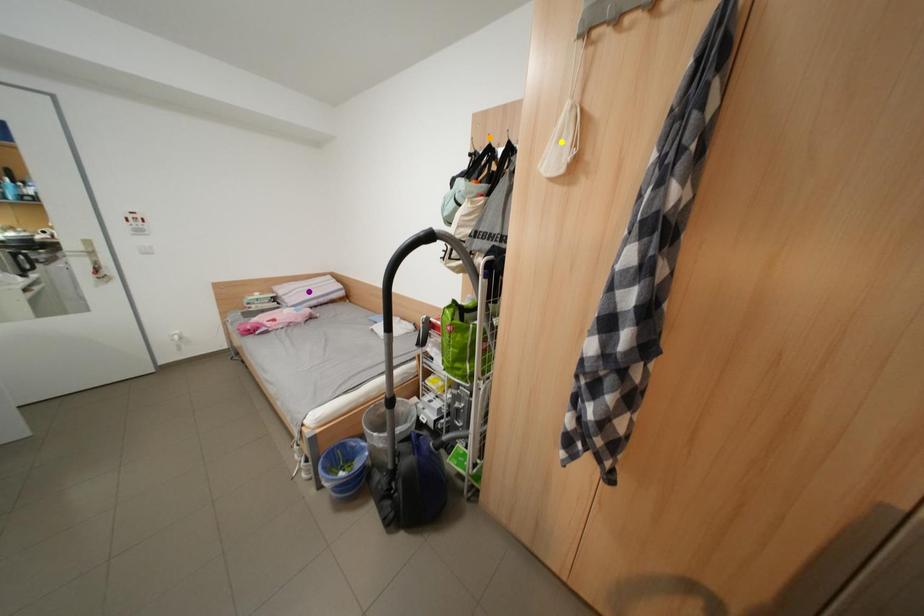
Order these from nearest to farthest:
- purple point
- yellow point
- orange point

purple point, orange point, yellow point